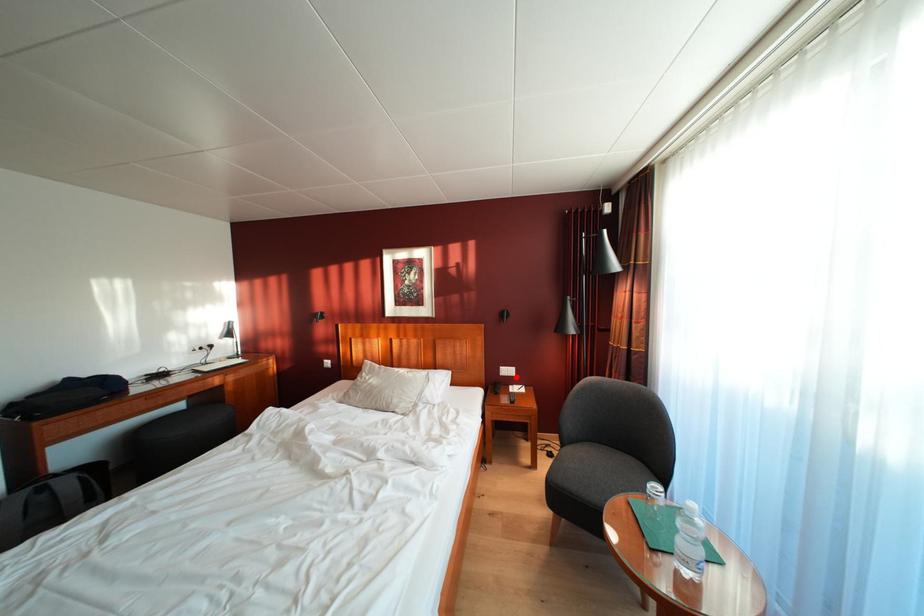
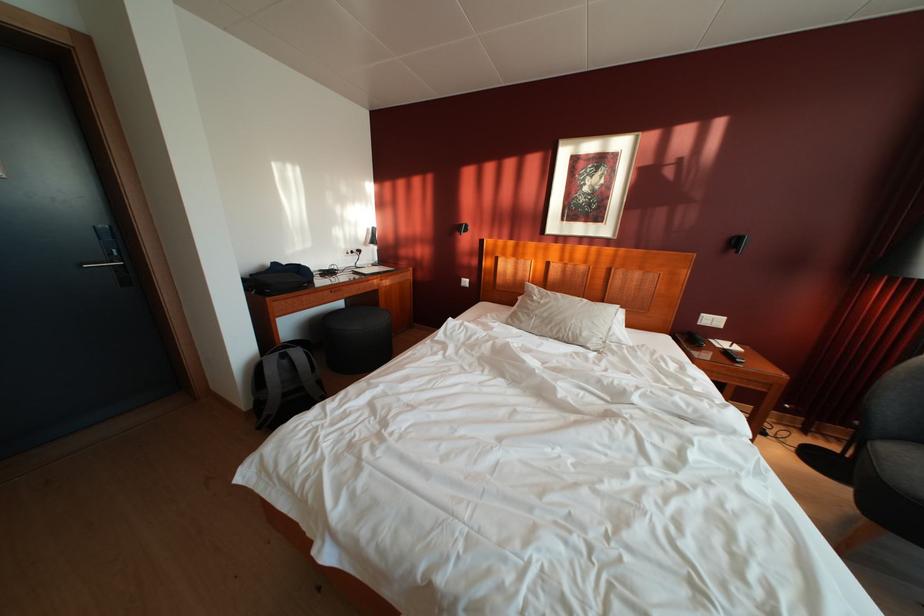
In the second image, find the point that corresponds to the highlighted location in the first image.

(721, 326)